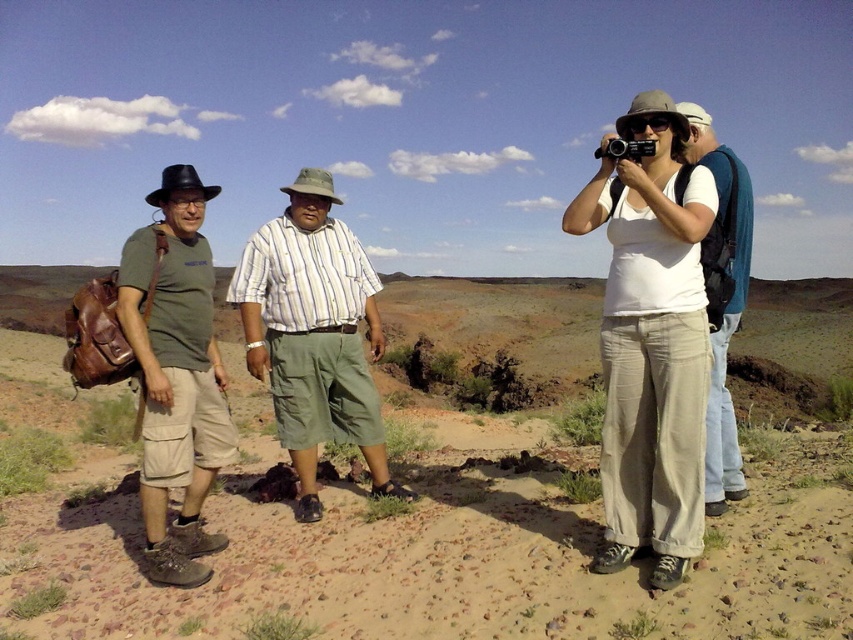
Question: Which object appears farthest from the camera in this image?

Choices:
 (A) white cotton tank top at center
 (B) green matte t-shirt at left

Answer: (B)

Question: Based on their relative distances, which object is farther from the green matte t-shirt at left?

Choices:
 (A) brown dirt field at center
 (B) white cotton shirt at center
 (C) striped cotton shirt at center
 (D) white cotton tank top at center

Answer: (A)

Question: Is brown dirt field at center smaller than white cotton shirt at center?

Choices:
 (A) no
 (B) yes

Answer: (A)

Question: From the image, what is the correct spatial relationship of brown dirt field at center in relation to white cotton tank top at center?

Choices:
 (A) below
 (B) above

Answer: (A)

Question: Which point appears closest to the camera in this image?

Choices:
 (A) (171, 387)
 (B) (776, 435)

Answer: (A)

Question: Does brown dirt field at center appear under white cotton shirt at center?

Choices:
 (A) yes
 (B) no

Answer: (A)